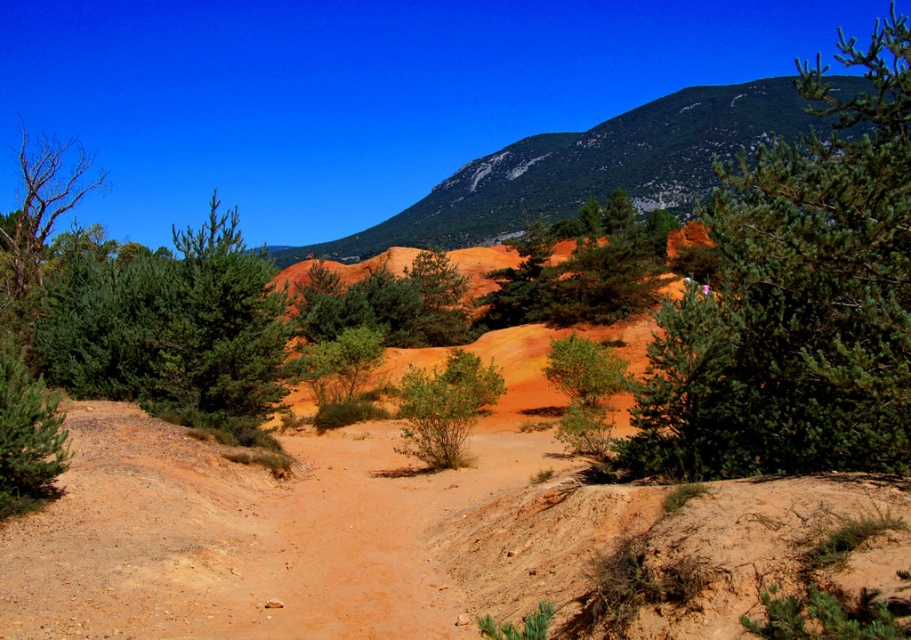
Question: Is green needle-like tree at center-right to the right of green rocky mountain at upper center from the viewer's perspective?

Choices:
 (A) no
 (B) yes

Answer: (B)

Question: Is green needle-like tree at center-right bigger than green textured bush at left?

Choices:
 (A) yes
 (B) no

Answer: (A)

Question: Which point appears closest to the camera in this image?

Choices:
 (A) click(x=39, y=442)
 (B) click(x=572, y=417)
 (C) click(x=267, y=360)

Answer: (A)

Question: Which object is farther from the camera taking this photo?

Choices:
 (A) green textured pine at center
 (B) green matte bush at center

Answer: (A)

Question: Can you confirm if green textured pine at center is positioned above green matte bush at center?

Choices:
 (A) no
 (B) yes

Answer: (B)

Question: Among these objects, which one is nearest to the camera?

Choices:
 (A) green textured pine at center
 (B) green needle-like tree at center-right
 (C) green rocky mountain at upper center
 (D) green matte bush at center

Answer: (B)